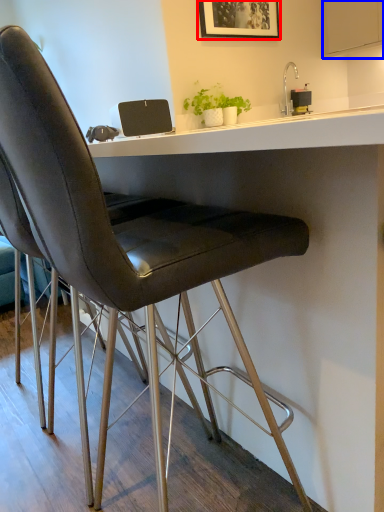
Question: Among these objects, which one is nearest to the camera, picture frame (highlighted by a red box) or cabinetry (highlighted by a blue box)?

Choices:
 (A) picture frame
 (B) cabinetry

Answer: (A)